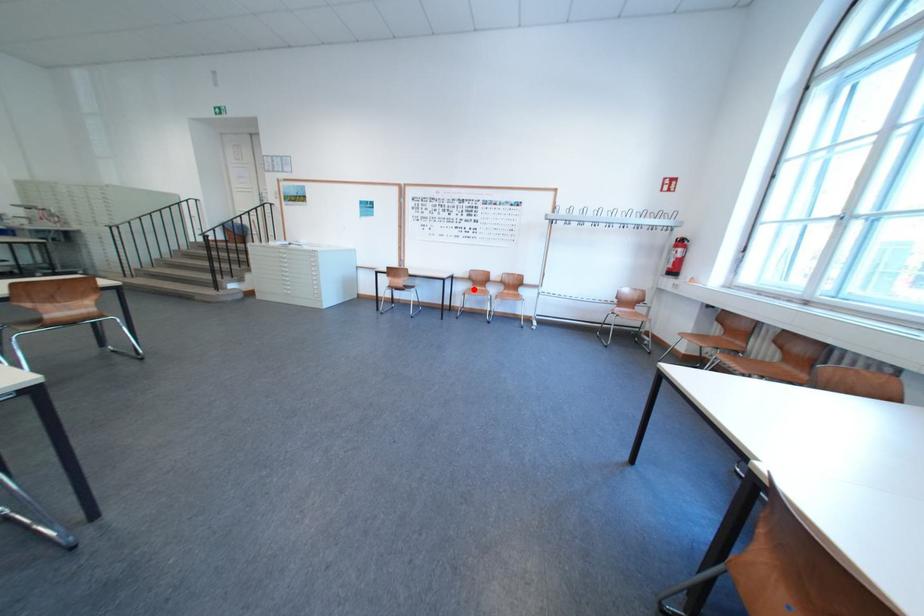
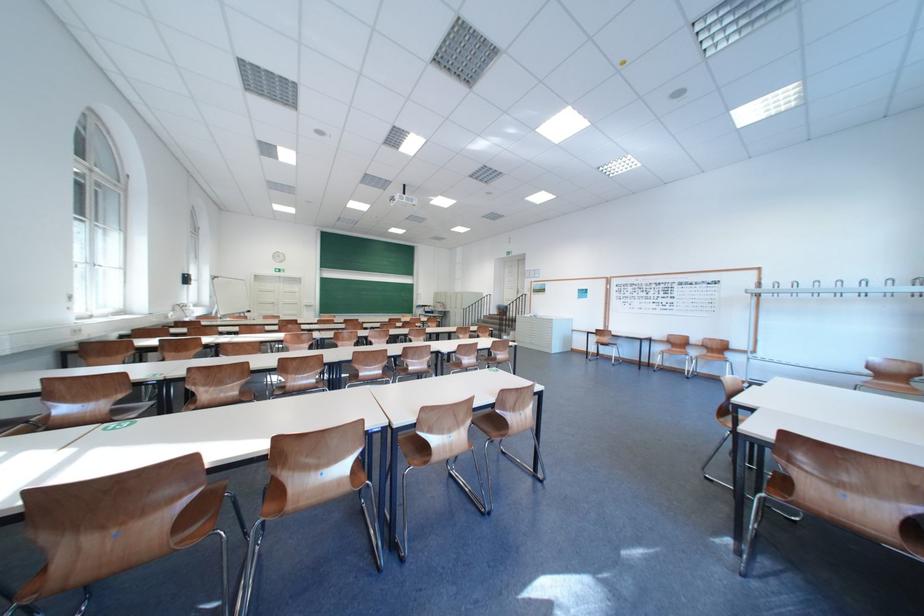
Where in the second image is the point corresponding to the highlighted location from the first image?

(673, 350)